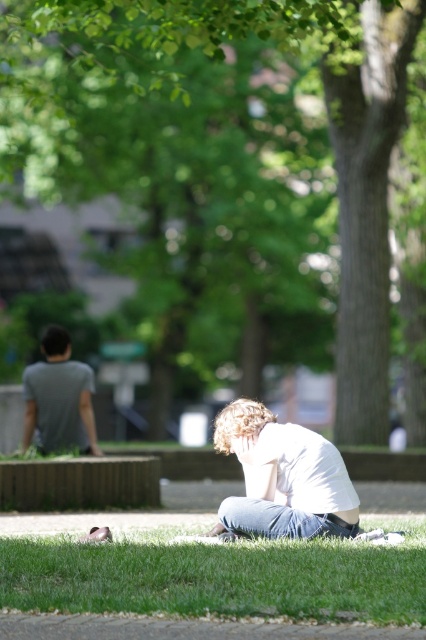
You are a photographer planning to take a picture of the green grass at lower center and the green leafy tree at upper center. Which object should you focus on first to ensure both are in focus? Please explain your reasoning based on their positions.

The green grass at lower center is behind the green leafy tree at upper center. To ensure both are in focus, you should focus on the green leafy tree at upper center first since it is closer to the camera. This way, the depth of field will extend backward to include the green grass at lower center in the background.